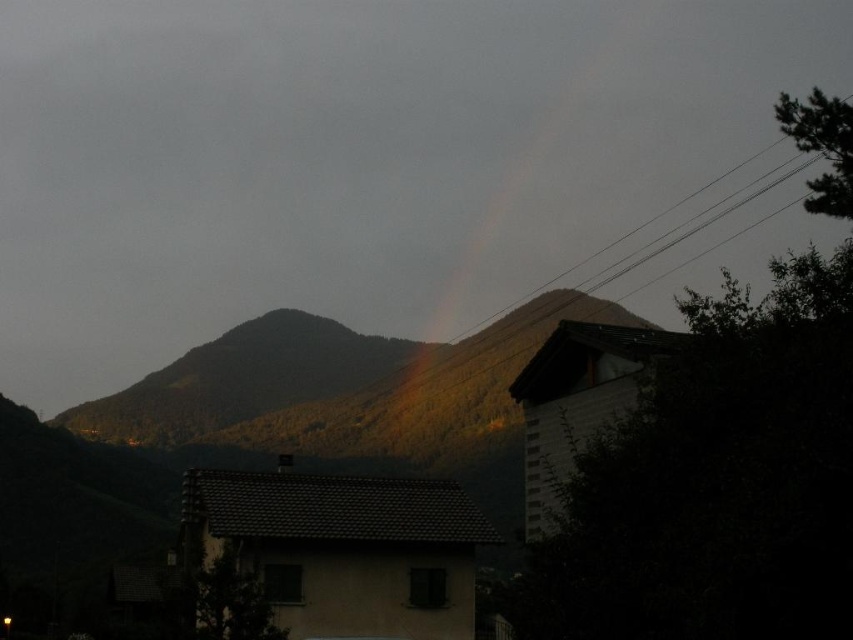
Is point (431, 355) less distant than point (560, 102)?

Yes, point (431, 355) is in front of point (560, 102).

Is green forested mountain at center taller than rainbow at upper center?

No.

What do you see at coordinates (339, 387) in the screenshot?
I see `green forested mountain at center` at bounding box center [339, 387].

This screenshot has width=853, height=640. I want to click on green forested mountain at center, so click(x=339, y=387).